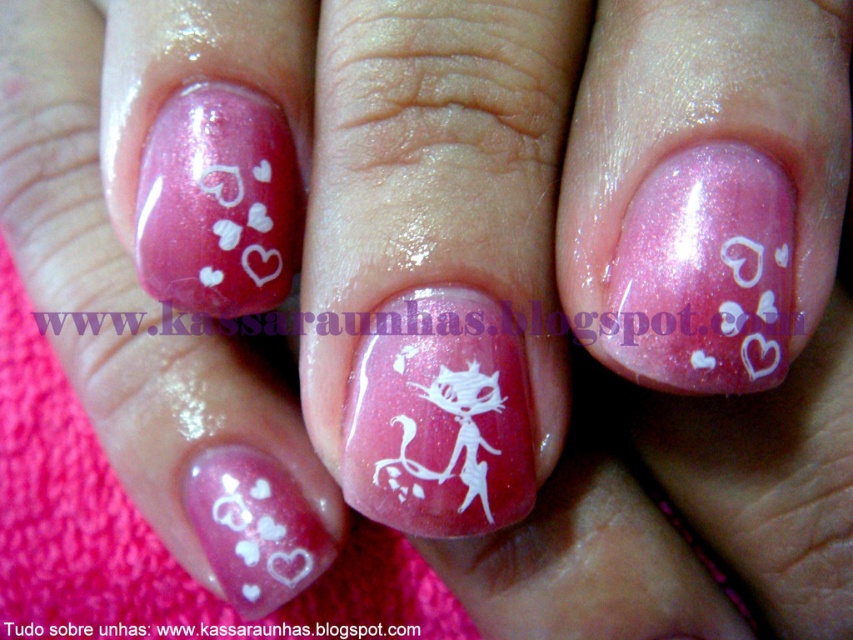
You are a photographer aiming to capture a close detail of the nail art on the thumb. You have a camera with a focus range of 20 to 25 inches. Is the point at point (714, 176) within your camera focus range?

The distance of point (714, 176) from the viewer is 22.14 inches, which falls within the camera focus range of 20 to 25 inches. Therefore, the camera can focus on the point at (714, 176).

Please look at the image of the hand with pink nail polish. There is a point at coordinates (703, 275). Is this point where the pink glitter nail polish at center is located?

Yes, the pink glitter nail polish at center is located at point (703, 275).

Consider the image. You are a nail artist trying to place a new design on the pink glitter nail polish at center and the white glossy cat at center. Which object is shorter in height?

The pink glitter nail polish at center is shorter than the white glossy cat at center.